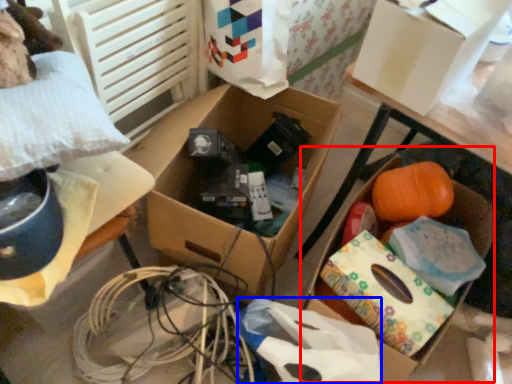
Question: Which object is further to the camera taking this photo, storage box (highlighted by a red box) or wrapping paper (highlighted by a blue box)?

Choices:
 (A) storage box
 (B) wrapping paper

Answer: (A)